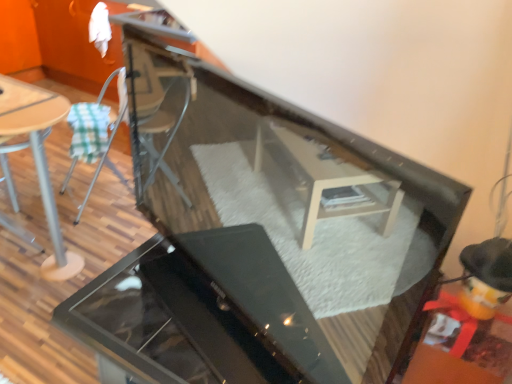
Question: From a real-world perspective, is metallic silver chair at left positioned above or below wooden table at left?

Choices:
 (A) above
 (B) below

Answer: (A)

Question: In the image, is metallic silver chair at left positioned in front of or behind wooden table at left?

Choices:
 (A) behind
 (B) front

Answer: (A)

Question: Estimate the real-world distances between objects in this image. Which object is farther from the wooden table at left?

Choices:
 (A) metallic silver chair at left
 (B) wooden table top at left
 (C) glossy black grill at center

Answer: (C)

Question: Estimate the real-world distances between objects in this image. Which object is closer to the wooden table top at left?

Choices:
 (A) glossy black grill at center
 (B) metallic silver chair at left
 (C) wooden table at left

Answer: (C)